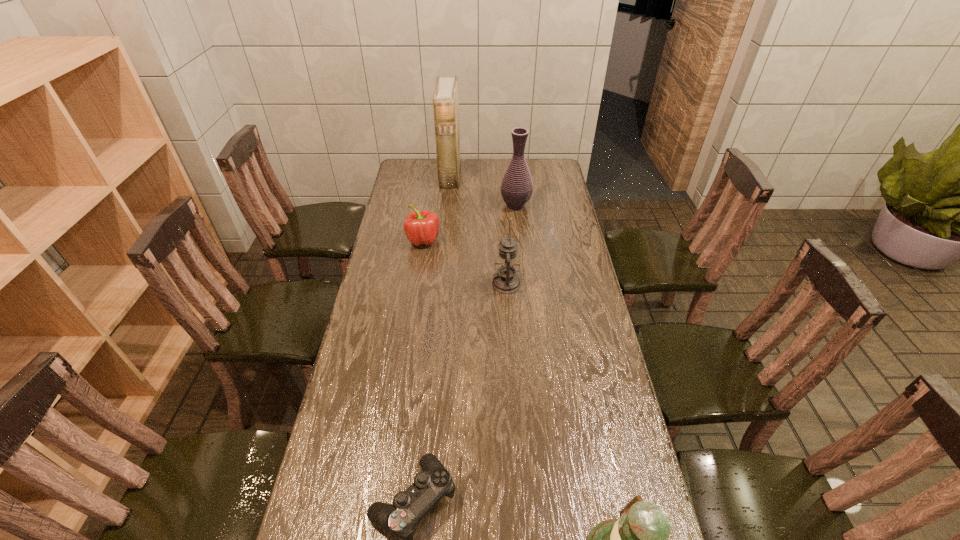
At what (x,y) coordinates should I click in order to perform the action: click on vacant space that is in between the pepper and the oil lamp. Please return your answer as a coordinate pair (x, y). Image resolution: width=960 pixels, height=540 pixels. Looking at the image, I should click on (465, 262).

Locate an element on the screen. This screenshot has height=540, width=960. unoccupied area between the third tallest object and the fifth tallest object is located at coordinates (465, 262).

The image size is (960, 540). What are the coordinates of `object that stands as the fifth closest to the pepper` in the screenshot? It's located at (639, 538).

Locate which object ranks third in proximity to the tallest object. Please provide its 2D coordinates. Your answer should be formatted as a tuple, i.e. [(x, y)], where the tuple contains the x and y coordinates of a point satisfying the conditions above.

[(506, 281)]

This screenshot has height=540, width=960. I want to click on free space that satisfies the following two spatial constraints: 1. on the cover of the farthest object; 2. on the right side of the fifth nearest object, so click(x=447, y=205).

At what (x,y) coordinates should I click in order to perform the action: click on free space that satisfies the following two spatial constraints: 1. on the cover of the phonebook; 2. on the back side of the oil lamp. Please return your answer as a coordinate pair (x, y). This screenshot has width=960, height=540. Looking at the image, I should click on (440, 284).

Locate an element on the screen. The height and width of the screenshot is (540, 960). free location that satisfies the following two spatial constraints: 1. on the cover of the phonebook; 2. on the right side of the fourth farthest object is located at coordinates (440, 284).

Identify the location of free region that satisfies the following two spatial constraints: 1. on the cover of the phonebook; 2. on the back side of the third nearest object. This screenshot has width=960, height=540. (440, 284).